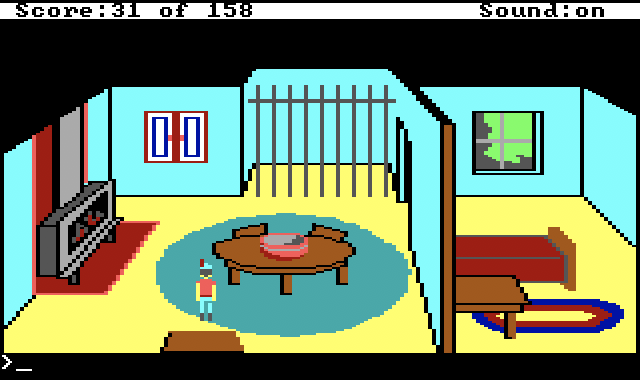
Find the location of a particular element. chairs next to round table is located at coordinates (333, 231), (249, 229).